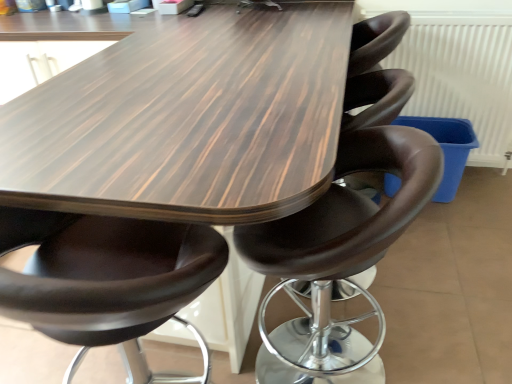
Question: Can you confirm if white textured radiator at upper right is taller than matte brown leather chair at center, which is the second chair from right to left?

Choices:
 (A) no
 (B) yes

Answer: (A)

Question: Can you confirm if white textured radiator at upper right is shorter than matte brown leather chair at center, which is the second chair from right to left?

Choices:
 (A) yes
 (B) no

Answer: (A)

Question: Is white textured radiator at upper right oriented away from matte brown leather chair at center, the first chair viewed from the left?

Choices:
 (A) yes
 (B) no

Answer: (B)

Question: From the image's perspective, is white textured radiator at upper right on top of matte brown leather chair at center, the first chair viewed from the left?

Choices:
 (A) no
 (B) yes

Answer: (B)

Question: Can you confirm if white textured radiator at upper right is smaller than matte brown leather chair at center, which is the second chair from right to left?

Choices:
 (A) yes
 (B) no

Answer: (A)

Question: From the image's perspective, is white textured radiator at upper right below matte brown leather chair at center, which is the second chair from right to left?

Choices:
 (A) yes
 (B) no

Answer: (B)

Question: Would you say brown leather stool at center, which ranks as the 1th chair in right-to-left order, is part of wooden table at center's contents?

Choices:
 (A) yes
 (B) no

Answer: (A)

Question: Does wooden table at center have a greater width compared to brown leather stool at center, acting as the 2th chair starting from the left?

Choices:
 (A) no
 (B) yes

Answer: (B)

Question: Is wooden table at center in front of brown leather stool at center, which ranks as the 1th chair in right-to-left order?

Choices:
 (A) no
 (B) yes

Answer: (B)

Question: Can you confirm if wooden table at center is positioned to the right of brown leather stool at center, acting as the 2th chair starting from the left?

Choices:
 (A) yes
 (B) no

Answer: (B)

Question: Considering the relative sizes of wooden table at center and brown leather stool at center, which ranks as the 1th chair in right-to-left order, in the image provided, is wooden table at center smaller than brown leather stool at center, which ranks as the 1th chair in right-to-left order,?

Choices:
 (A) yes
 (B) no

Answer: (B)

Question: Is wooden table at center not near brown leather stool at center, which ranks as the 1th chair in right-to-left order?

Choices:
 (A) no
 (B) yes

Answer: (A)

Question: Is matte brown leather chair at center, the first chair viewed from the left, positioned before brown leather stool at center, which ranks as the 1th chair in right-to-left order?

Choices:
 (A) yes
 (B) no

Answer: (A)